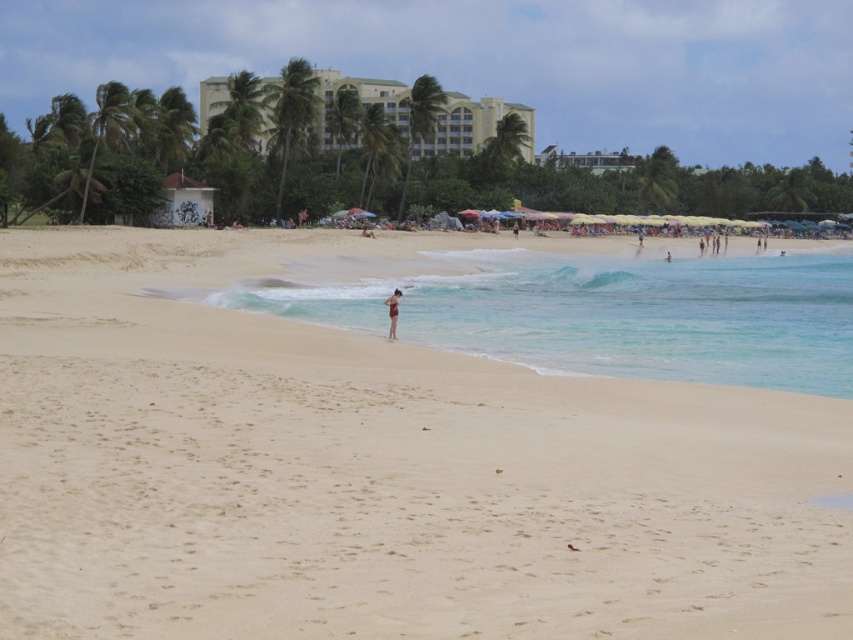
Question: Which object is positioned closest to the clear blue water at center?

Choices:
 (A) smooth tan skin at center
 (B) light beige sand at center

Answer: (B)

Question: Among these points, which one is nearest to the camera?

Choices:
 (A) (326, 125)
 (B) (384, 301)

Answer: (B)

Question: Among these points, which one is nearest to the camera?

Choices:
 (A) (395, 326)
 (B) (525, 115)
 (C) (659, 406)

Answer: (C)

Question: Is light beige sand at center smaller than clear blue water at center?

Choices:
 (A) no
 (B) yes

Answer: (B)

Question: Can you confirm if light beige sand at center is positioned below clear blue water at center?

Choices:
 (A) no
 (B) yes

Answer: (B)

Question: Is clear blue water at center to the left of smooth tan skin at center from the viewer's perspective?

Choices:
 (A) yes
 (B) no

Answer: (B)